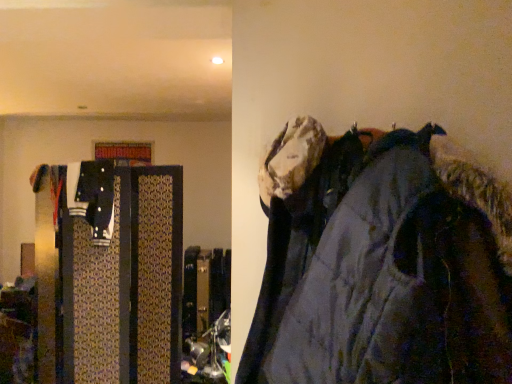
Question: From a real-world perspective, is patterned fabric suitcase at left physically located above or below dark gray fabric jacket at right?

Choices:
 (A) above
 (B) below

Answer: (B)

Question: Is point (173, 170) closer or farther from the camera than point (295, 269)?

Choices:
 (A) closer
 (B) farther

Answer: (B)

Question: From their relative heights in the image, would you say patterned fabric suitcase at left is taller or shorter than dark gray fabric jacket at right?

Choices:
 (A) short
 (B) tall

Answer: (B)

Question: Is dark gray fabric jacket at right bigger or smaller than patterned fabric suitcase at left?

Choices:
 (A) small
 (B) big

Answer: (A)

Question: From a real-world perspective, relative to patterned fabric suitcase at left, is dark gray fabric jacket at right vertically above or below?

Choices:
 (A) above
 (B) below

Answer: (A)

Question: Looking at their shapes, would you say dark gray fabric jacket at right is wider or thinner than patterned fabric suitcase at left?

Choices:
 (A) wide
 (B) thin

Answer: (A)

Question: Is dark gray fabric jacket at right to the left or to the right of patterned fabric suitcase at left in the image?

Choices:
 (A) left
 (B) right

Answer: (B)